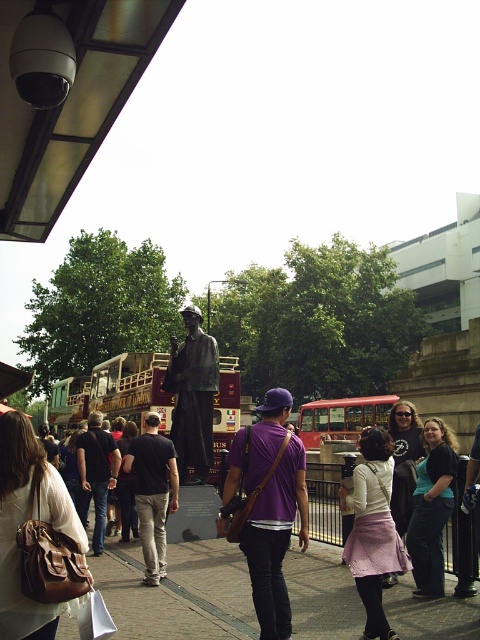
Is dark gray fabric jacket at center closer to the viewer compared to red metallic bus at center?

Yes, it is in front of red metallic bus at center.

Between point (108, 452) and point (320, 403), which one is positioned in front?

Point (108, 452) is in front.

What do you see at coordinates (96, 474) in the screenshot?
I see `dark gray fabric jacket at center` at bounding box center [96, 474].

The height and width of the screenshot is (640, 480). I want to click on dark gray fabric jacket at center, so click(x=96, y=474).

Locate an element on the screen. bronze statue at center is located at coordinates (192, 396).

Is dark gray fabric pants at center in front of red metallic bus at center?

Yes, it is in front of red metallic bus at center.

Is dark gray fabric pants at center to the left of red metallic bus at center from the viewer's perspective?

Correct, you'll find dark gray fabric pants at center to the left of red metallic bus at center.

The image size is (480, 640). I want to click on dark gray fabric pants at center, so click(153, 492).